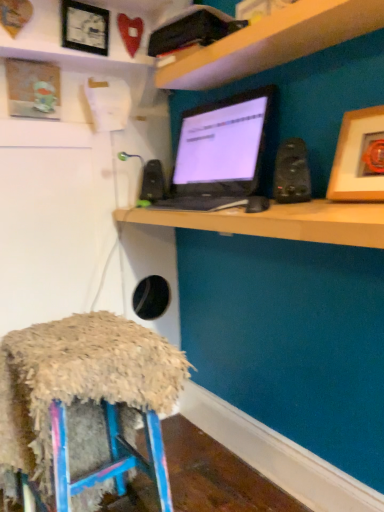
The height and width of the screenshot is (512, 384). What are the coordinates of `vacant region in front of black plastic speaker at upper right, the first speaker positioned from the right` in the screenshot? It's located at (306, 207).